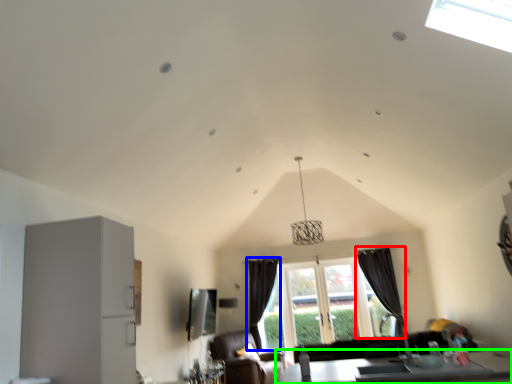
Question: Considering the real-world distances, which object is closest to curtain (highlighted by a red box)? curtain (highlighted by a blue box) or table (highlighted by a green box).

Choices:
 (A) curtain
 (B) table

Answer: (A)